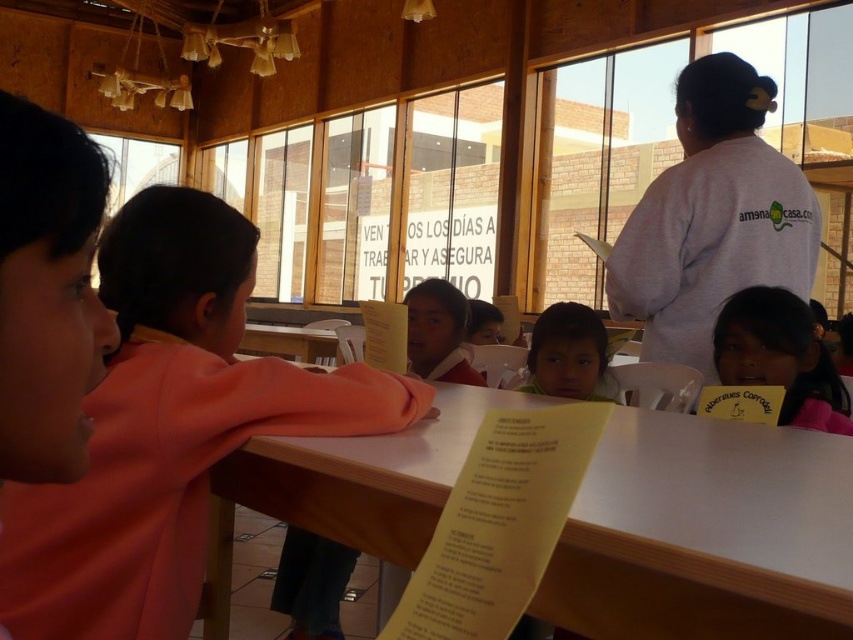
Does white wood table at center have a larger size compared to white cotton shirt at upper right?

Actually, white wood table at center might be smaller than white cotton shirt at upper right.

Who is taller, white wood table at center or white cotton shirt at upper right?

white cotton shirt at upper right

Is point (666, 616) positioned before point (804, 282)?

Yes, point (666, 616) is in front of point (804, 282).

Where is `white wood table at center`? white wood table at center is located at coordinates (706, 534).

Which is in front, point (811, 376) or point (583, 346)?

Point (811, 376) is more forward.

Between pink fabric headband at upper right and smooth skin child at center, which one has more height?

pink fabric headband at upper right is taller.

The width and height of the screenshot is (853, 640). What do you see at coordinates (780, 356) in the screenshot?
I see `pink fabric headband at upper right` at bounding box center [780, 356].

Where is `pink fabric headband at upper right`? The height and width of the screenshot is (640, 853). pink fabric headband at upper right is located at coordinates (780, 356).

Between pink fabric shirt at left and pink fabric headband at upper right, which one appears on the left side from the viewer's perspective?

Positioned to the left is pink fabric shirt at left.

Is pink fabric shirt at left smaller than pink fabric headband at upper right?

No, pink fabric shirt at left is not smaller than pink fabric headband at upper right.

Where is `pink fabric shirt at left`? This screenshot has height=640, width=853. pink fabric shirt at left is located at coordinates (167, 428).